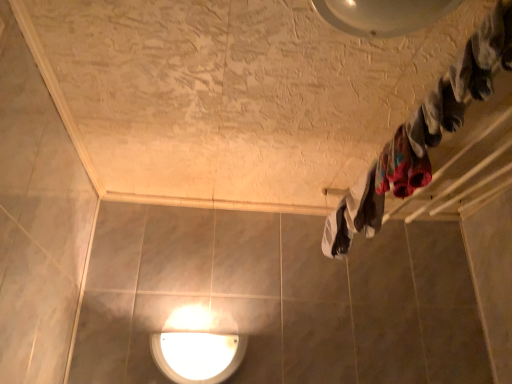
What is the approximate height of white fabric at center, which ranks as the 2th clothing in front-to-back order?

5.91 inches.

Find the location of a particular element. This screenshot has height=384, width=512. multicolored fabric at upper right, which appears as the first clothing when viewed from the front is located at coordinates (401, 167).

Between multicolored fabric at upper right, the 2th clothing viewed from the back, and white fabric at center, which ranks as the 2th clothing in front-to-back order, which one appears on the left side from the viewer's perspective?

white fabric at center, which ranks as the 2th clothing in front-to-back order, is more to the left.

Is point (420, 158) closer or farther from the camera than point (375, 222)?

Point (420, 158) appears to be closer to the viewer than point (375, 222).

Locate an element on the screen. Image resolution: width=512 pixels, height=384 pixels. clothing in front of the white fabric at center, which ranks as the 2th clothing in front-to-back order is located at coordinates (401, 167).

From their relative heights in the image, would you say multicolored fabric at upper right, which appears as the first clothing when viewed from the front, is taller or shorter than white glossy light fixture at center?

Clearly, multicolored fabric at upper right, which appears as the first clothing when viewed from the front, is shorter compared to white glossy light fixture at center.

Which object is positioned more to the left, multicolored fabric at upper right, which appears as the first clothing when viewed from the front, or white glossy light fixture at center?

white glossy light fixture at center is more to the left.

Looking at this image, is white glossy light fixture at center surrounded by multicolored fabric at upper right, which appears as the first clothing when viewed from the front?

No, white glossy light fixture at center is not a part of multicolored fabric at upper right, which appears as the first clothing when viewed from the front.

From a real-world perspective, is multicolored fabric at upper right, which appears as the first clothing when viewed from the front, located higher than white glossy light fixture at center?

Yes.

Does white glossy light fixture at center come in front of white fabric at center, the 1th clothing positioned from the back?

That is False.

From their relative heights in the image, would you say white glossy light fixture at center is taller or shorter than white fabric at center, which ranks as the 2th clothing in front-to-back order?

white glossy light fixture at center is taller than white fabric at center, which ranks as the 2th clothing in front-to-back order.

Locate an element on the screen. The height and width of the screenshot is (384, 512). lamp behind the white fabric at center, the 1th clothing positioned from the back is located at coordinates (196, 348).

How far apart are white fabric at center, which ranks as the 2th clothing in front-to-back order, and white glossy light fixture at center?

white fabric at center, which ranks as the 2th clothing in front-to-back order, is 21.71 inches away from white glossy light fixture at center.

Consider the image. How different are the orientations of white fabric at center, the 1th clothing positioned from the back, and white glossy light fixture at center in degrees?

There is a 90.3-degree angle between the facing directions of white fabric at center, the 1th clothing positioned from the back, and white glossy light fixture at center.

Is white fabric at center, the 1th clothing positioned from the back, positioned in front of white glossy light fixture at center?

That is True.

From a real-world perspective, which object stands above the other?

white fabric at center, the 1th clothing positioned from the back, is physically above.

Find the location of a particular element. The image size is (512, 384). lamp behind the multicolored fabric at upper right, the 2th clothing viewed from the back is located at coordinates (196, 348).

Considering the positions of objects white glossy light fixture at center and multicolored fabric at upper right, which appears as the first clothing when viewed from the front, in the image provided, who is more to the right, white glossy light fixture at center or multicolored fabric at upper right, which appears as the first clothing when viewed from the front,?

multicolored fabric at upper right, which appears as the first clothing when viewed from the front.

Where is `clothing below the multicolored fabric at upper right, which appears as the first clothing when viewed from the front (from the image's perspective)`? Image resolution: width=512 pixels, height=384 pixels. clothing below the multicolored fabric at upper right, which appears as the first clothing when viewed from the front (from the image's perspective) is located at coordinates (354, 215).

Which point is more forward, (340, 234) or (410, 190)?

The point (410, 190) is closer to the camera.

From the image's perspective, which is above, white fabric at center, the 1th clothing positioned from the back, or multicolored fabric at upper right, which appears as the first clothing when viewed from the front?

multicolored fabric at upper right, which appears as the first clothing when viewed from the front, appears higher in the image.

From a real-world perspective, is white fabric at center, which ranks as the 2th clothing in front-to-back order, positioned over multicolored fabric at upper right, the 2th clothing viewed from the back, based on gravity?

Yes, from a real-world perspective, white fabric at center, which ranks as the 2th clothing in front-to-back order, is on top of multicolored fabric at upper right, the 2th clothing viewed from the back.

The width and height of the screenshot is (512, 384). Find the location of `clothing above the white fabric at center, the 1th clothing positioned from the back (from the image's perspective)`. clothing above the white fabric at center, the 1th clothing positioned from the back (from the image's perspective) is located at coordinates (401, 167).

Starting from the white glossy light fixture at center, which clothing is the 2nd one to the right? Please provide its 2D coordinates.

[(401, 167)]

Looking at this image, looking at the image, which one is located closer to white fabric at center, the 1th clothing positioned from the back, white glossy light fixture at center or multicolored fabric at upper right, the 2th clothing viewed from the back?

Based on the image, multicolored fabric at upper right, the 2th clothing viewed from the back, appears to be nearer to white fabric at center, the 1th clothing positioned from the back.

Looking at the image, which one is located closer to multicolored fabric at upper right, the 2th clothing viewed from the back, white fabric at center, the 1th clothing positioned from the back, or white glossy light fixture at center?

white fabric at center, the 1th clothing positioned from the back, is positioned closer to the anchor multicolored fabric at upper right, the 2th clothing viewed from the back.

Based on the photo, when comparing their distances from multicolored fabric at upper right, the 2th clothing viewed from the back, does white glossy light fixture at center or white fabric at center, which ranks as the 2th clothing in front-to-back order, seem further?

Based on the image, white glossy light fixture at center appears to be further to multicolored fabric at upper right, the 2th clothing viewed from the back.

Looking at this image, looking at the image, which one is located further to white fabric at center, which ranks as the 2th clothing in front-to-back order, multicolored fabric at upper right, the 2th clothing viewed from the back, or white glossy light fixture at center?

The object further to white fabric at center, which ranks as the 2th clothing in front-to-back order, is white glossy light fixture at center.

From the image, which object appears to be nearer to white glossy light fixture at center, multicolored fabric at upper right, which appears as the first clothing when viewed from the front, or white fabric at center, which ranks as the 2th clothing in front-to-back order?

white fabric at center, which ranks as the 2th clothing in front-to-back order, lies closer to white glossy light fixture at center than the other object.

When comparing their distances from white glossy light fixture at center, does white fabric at center, the 1th clothing positioned from the back, or multicolored fabric at upper right, which appears as the first clothing when viewed from the front, seem closer?

Based on the image, white fabric at center, the 1th clothing positioned from the back, appears to be nearer to white glossy light fixture at center.

The height and width of the screenshot is (384, 512). Find the location of `clothing between multicolored fabric at upper right, which appears as the first clothing when viewed from the front, and white glossy light fixture at center, in the vertical direction`. clothing between multicolored fabric at upper right, which appears as the first clothing when viewed from the front, and white glossy light fixture at center, in the vertical direction is located at coordinates (354, 215).